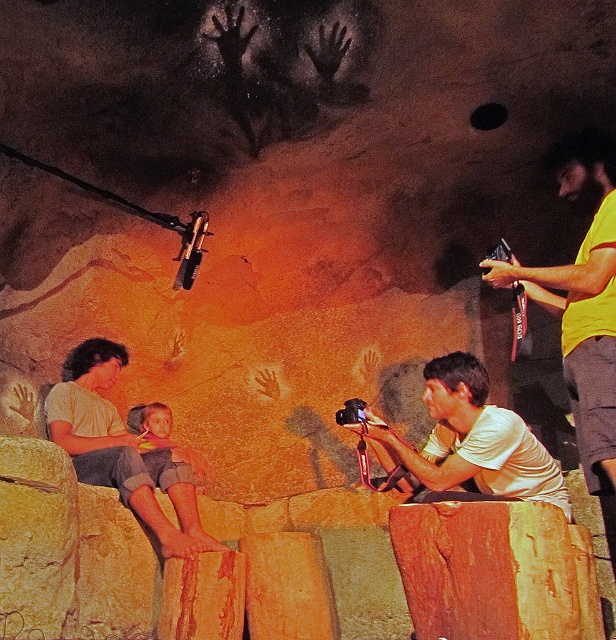
You are a photographer in the cave setting. You notice two people wearing matte white shirt at center and matte yellow shirt at left. Which person is shorter?

The matte white shirt at center is shorter than the matte yellow shirt at left, so the person wearing the matte white shirt at center is shorter.

You are an observer in the cave setting. You notice two shirts in the scene. Which shirt, the yellow fabric shirt at upper right or the matte white shirt at center, appears narrower?

The yellow fabric shirt at upper right appears narrower than the matte white shirt at center.